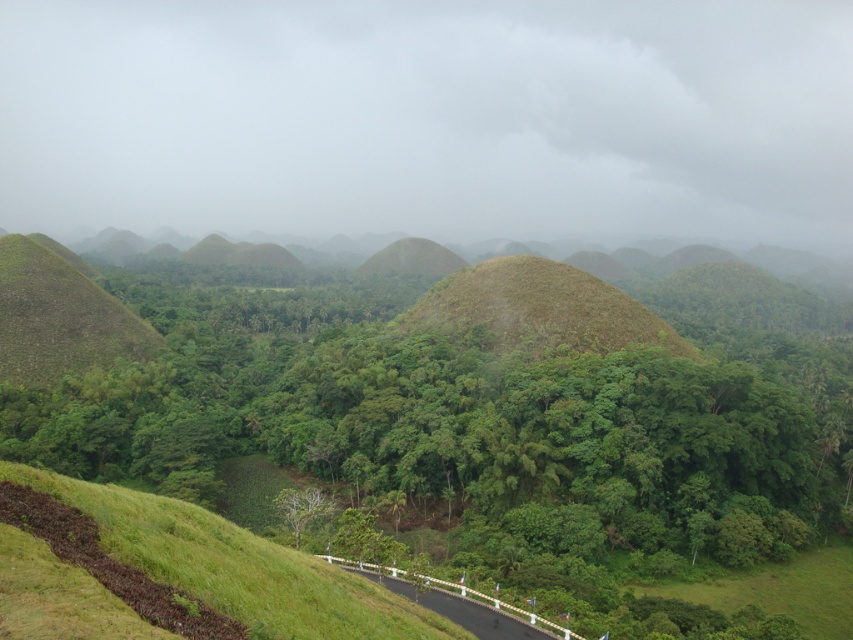
You are planning to take a photo of the brown grassy hill at center from the black asphalt road at lower center. Considering the height difference between them, will the hill be mostly visible in the photo?

The brown grassy hill at center is much taller than the black asphalt road at lower center, so the hill will be mostly visible in the photo.

From the picture: You are a hiker planning to traverse the Chocolate Hills and see the green grassy hill at center and the brown grassy hill at center. Which hill should you climb first if you want to start from the left side of the landscape?

You should climb the green grassy hill at center first because it is positioned to the left of the brown grassy hill at center, making it the closer option when starting from the left side of the landscape.

You are a hiker standing at the start of the black asphalt road at lower center. You want to reach the green leafy tree at center. Which direction should you walk to get closer to the tree?

Since the black asphalt road at lower center is closer to the viewer than the green leafy tree at center, you should walk forward along the road to move towards the tree.